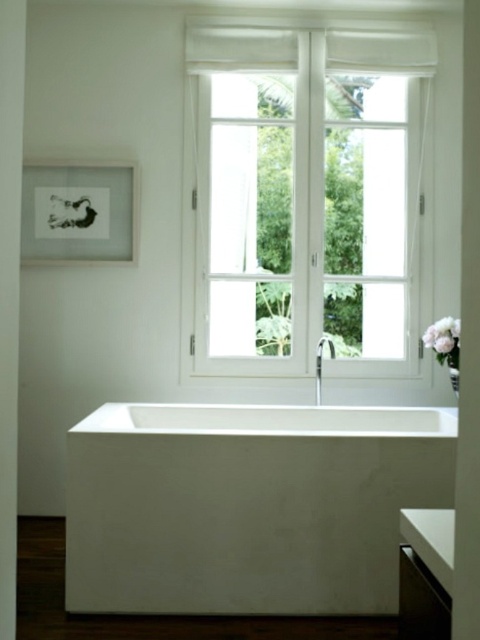
Question: Is white glass window at center to the left of white matte flower at right from the viewer's perspective?

Choices:
 (A) yes
 (B) no

Answer: (A)

Question: Is white glass window at center closer to camera compared to white smooth bathtub at center?

Choices:
 (A) yes
 (B) no

Answer: (B)

Question: Is matte black picture frame at upper left to the right of white matte flower at right from the viewer's perspective?

Choices:
 (A) yes
 (B) no

Answer: (B)

Question: Which of the following is the closest to the observer?

Choices:
 (A) white matte flower at right
 (B) white glass window at center
 (C) matte black picture frame at upper left

Answer: (A)

Question: Which is nearer to the white smooth bathtub at center?

Choices:
 (A) white matte flower at right
 (B) white glass window at center

Answer: (A)

Question: Among these points, which one is farthest from the camera?

Choices:
 (A) (176, 483)
 (B) (437, 355)
 (C) (108, 189)
 (D) (192, 241)

Answer: (D)